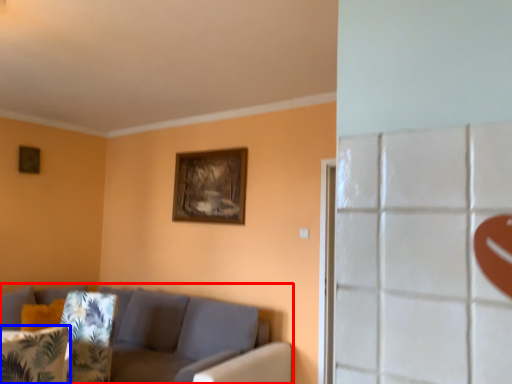
Question: Which object appears farthest to the camera in this image, studio couch (highlighted by a red box) or pillow (highlighted by a blue box)?

Choices:
 (A) studio couch
 (B) pillow

Answer: (A)